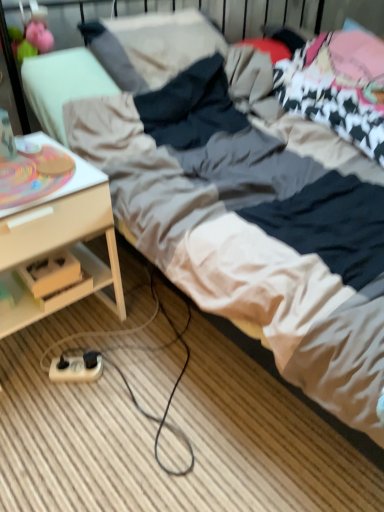
Locate an element on the screen. Image resolution: width=384 pixels, height=512 pixels. vacant area located to the right-hand side of white wood desk at lower left is located at coordinates click(x=154, y=339).